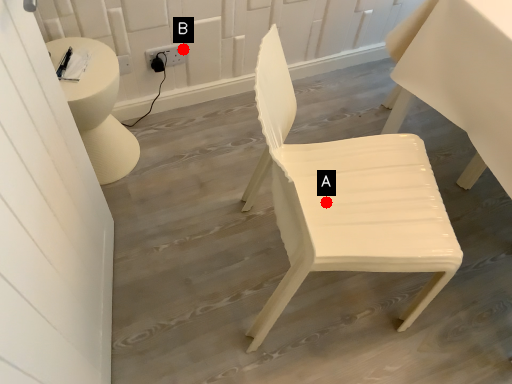
Question: Two points are circled on the image, labeled by A and B beside each circle. Which of the following is the farthest from the observer?

Choices:
 (A) A is further
 (B) B is further

Answer: (B)